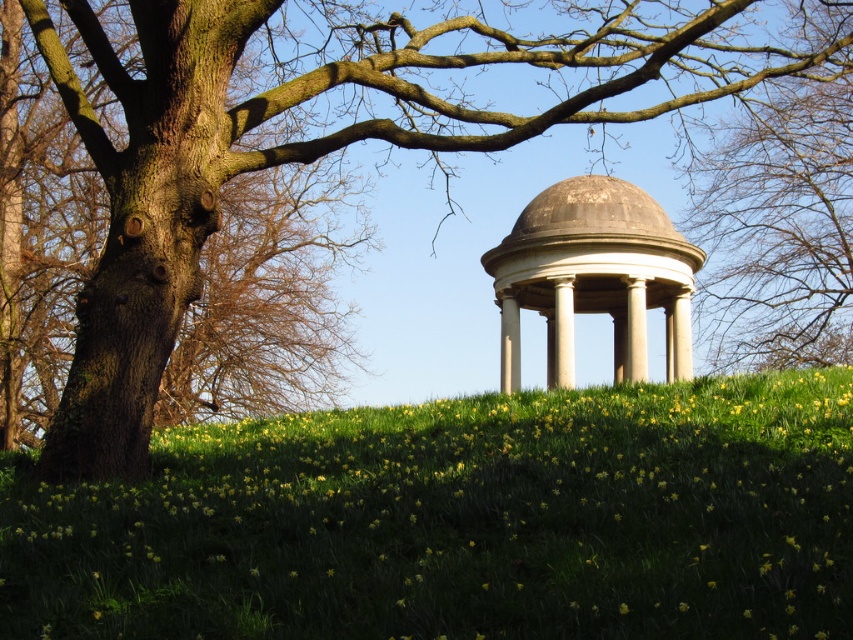
Question: Which point is closer to the camera?

Choices:
 (A) (753, 376)
 (B) (506, 252)

Answer: (A)

Question: Which of the following is the closest to the observer?

Choices:
 (A) (265, 502)
 (B) (715, 280)

Answer: (A)

Question: Does brown rough tree at upper center appear over stone gazebo at center?

Choices:
 (A) no
 (B) yes

Answer: (B)

Question: Which of the following is the closest to the observer?

Choices:
 (A) (840, 348)
 (B) (231, 474)
 (C) (677, 259)

Answer: (B)

Question: Is brown rough tree at upper center to the right of stone gazebo at center from the viewer's perspective?

Choices:
 (A) yes
 (B) no

Answer: (A)

Question: Considering the relative positions of green grassy hillside at center and brown rough tree at upper center in the image provided, where is green grassy hillside at center located with respect to brown rough tree at upper center?

Choices:
 (A) left
 (B) right

Answer: (A)